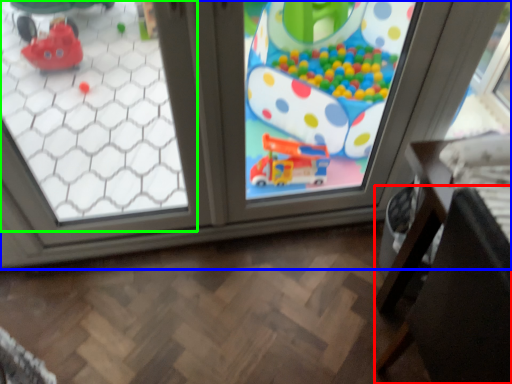
Question: Considering the real-world distances, which object is farthest from chair (highlighted by a red box)? window (highlighted by a blue box) or window (highlighted by a green box)?

Choices:
 (A) window
 (B) window

Answer: (B)